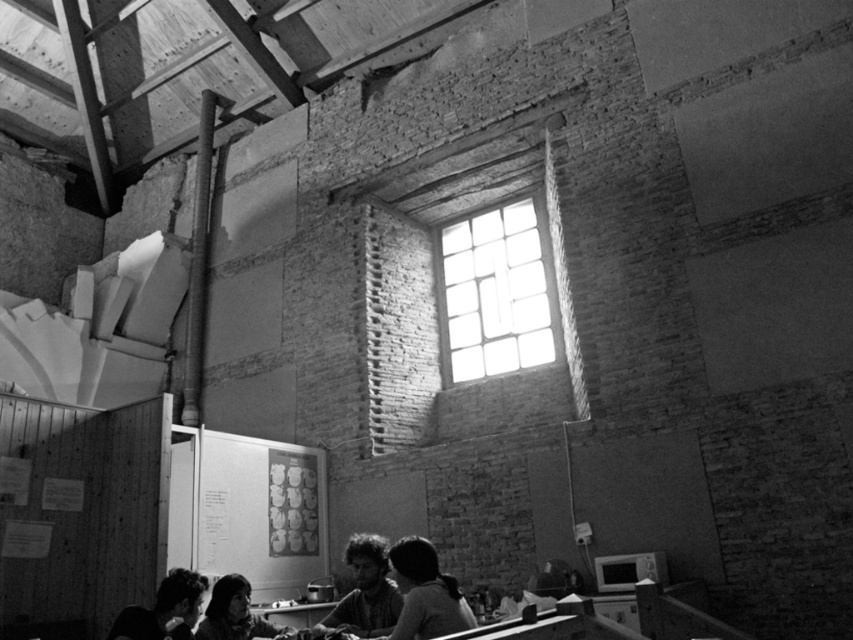
Question: Among these objects, which one is farthest from the camera?

Choices:
 (A) smooth skin at lower left
 (B) dark hair at center
 (C) smooth black hair at lower left

Answer: (A)

Question: Does smooth black hair at lower center have a greater width compared to smooth skin at lower left?

Choices:
 (A) no
 (B) yes

Answer: (A)

Question: Which object appears closest to the camera in this image?

Choices:
 (A) smooth black hair at lower left
 (B) dark hair at center

Answer: (A)

Question: Considering the relative positions of smooth black hair at lower center and smooth black hair at lower left in the image provided, where is smooth black hair at lower center located with respect to smooth black hair at lower left?

Choices:
 (A) left
 (B) right

Answer: (B)

Question: Is dark hair at center to the left of smooth black hair at lower left from the viewer's perspective?

Choices:
 (A) yes
 (B) no

Answer: (B)

Question: Which object is positioned closest to the smooth skin at lower left?

Choices:
 (A) smooth black hair at lower center
 (B) smooth black hair at lower left
 (C) dark hair at center

Answer: (B)